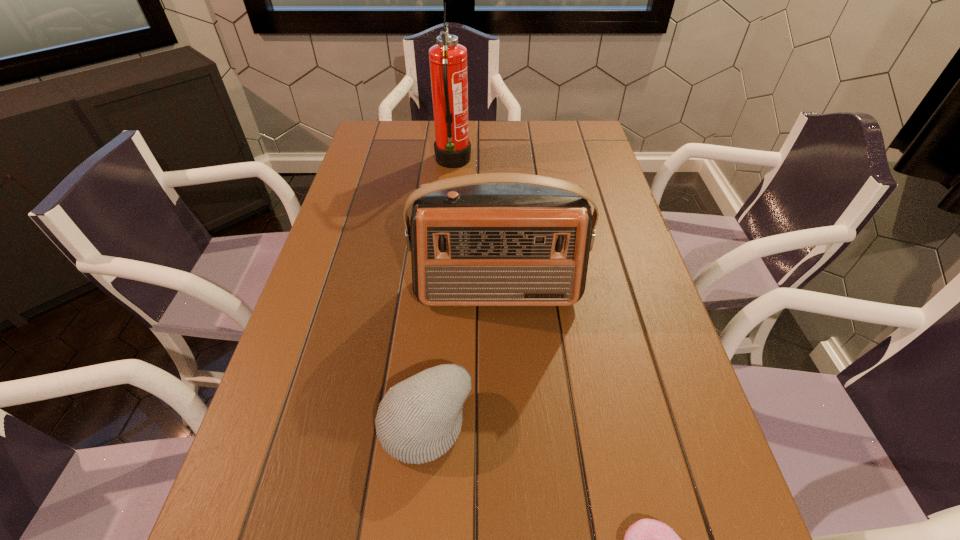
Locate an element on the screen. Image resolution: width=960 pixels, height=540 pixels. fire extinguisher is located at coordinates (448, 60).

Find the location of `the tallest object`. the tallest object is located at coordinates (448, 60).

Locate an element on the screen. The image size is (960, 540). radio receiver is located at coordinates (494, 239).

Locate an element on the screen. the second tallest object is located at coordinates (494, 239).

The height and width of the screenshot is (540, 960). I want to click on the second shortest object, so click(418, 420).

The height and width of the screenshot is (540, 960). I want to click on beanie, so click(x=418, y=420).

This screenshot has height=540, width=960. What are the coordinates of `vacant space located on the front-facing side of the tallest object` in the screenshot? It's located at (575, 163).

The height and width of the screenshot is (540, 960). Find the location of `free space located 0.160m on the front-facing side of the third shortest object`. free space located 0.160m on the front-facing side of the third shortest object is located at coordinates (501, 375).

Locate an element on the screen. The width and height of the screenshot is (960, 540). vacant region located 0.160m on the back of the second shortest object is located at coordinates [x=435, y=319].

What are the coordinates of `object located at the far edge` in the screenshot? It's located at (448, 60).